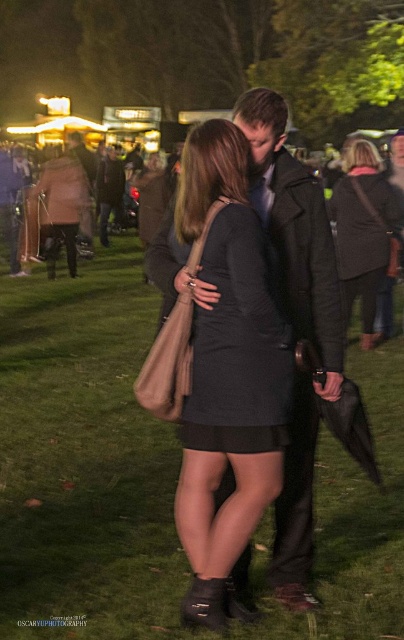
You are a photographer at the event and want to capture a photo of the dark gray dress at center without the green grass at center showing in the background. Is this possible based on their positions?

The green grass at center is positioned under the dark gray dress at center, so it is possible to capture the dark gray dress at center without the green grass at center showing in the background by adjusting the camera angle to avoid the grass underneath.